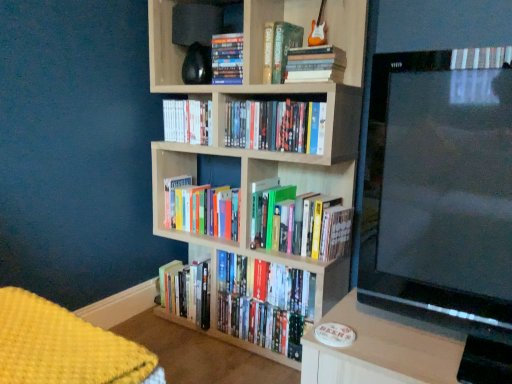
Question: Does yellow knitted blanket at lower left have a lesser height compared to black glossy tv at right?

Choices:
 (A) no
 (B) yes

Answer: (B)

Question: From a real-world perspective, is yellow knitted blanket at lower left positioned under black glossy tv at right based on gravity?

Choices:
 (A) no
 (B) yes

Answer: (B)

Question: Does yellow knitted blanket at lower left have a greater height compared to black glossy tv at right?

Choices:
 (A) no
 (B) yes

Answer: (A)

Question: Would you say yellow knitted blanket at lower left contains black glossy tv at right?

Choices:
 (A) no
 (B) yes

Answer: (A)

Question: Can we say yellow knitted blanket at lower left lies outside black glossy tv at right?

Choices:
 (A) no
 (B) yes

Answer: (B)

Question: Is hardcover book at center, which is counted as the 1th book, starting from the top, wider or thinner than matte black shelf at upper center?

Choices:
 (A) thin
 (B) wide

Answer: (A)

Question: In terms of height, does hardcover book at center, the 8th book positioned from the bottom, look taller or shorter compared to matte black shelf at upper center?

Choices:
 (A) tall
 (B) short

Answer: (B)

Question: Is point (282, 72) closer or farther from the camera than point (157, 89)?

Choices:
 (A) farther
 (B) closer

Answer: (B)

Question: Is hardcover book at center, which is counted as the 1th book, starting from the top, bigger or smaller than matte black shelf at upper center?

Choices:
 (A) small
 (B) big

Answer: (A)

Question: Relative to black glossy tv at right, is hardcover book at center, arranged as the fourth book when viewed from the top, in front or behind?

Choices:
 (A) behind
 (B) front

Answer: (A)

Question: Considering the positions of hardcover book at center, the 5th book when ordered from bottom to top, and black glossy tv at right in the image, is hardcover book at center, the 5th book when ordered from bottom to top, taller or shorter than black glossy tv at right?

Choices:
 (A) tall
 (B) short

Answer: (B)

Question: In terms of size, does hardcover book at center, the 5th book when ordered from bottom to top, appear bigger or smaller than black glossy tv at right?

Choices:
 (A) small
 (B) big

Answer: (A)

Question: In the image, is hardcover book at center, arranged as the fourth book when viewed from the top, on the left side or the right side of black glossy tv at right?

Choices:
 (A) right
 (B) left

Answer: (B)

Question: Is hardcover books at center, the sixth book from the top, bigger or smaller than hardcover books at center, arranged as the fifth book when viewed from the top?

Choices:
 (A) small
 (B) big

Answer: (B)

Question: In the image, is hardcover books at center, marked as the 3th book in a bottom-to-top arrangement, positioned in front of or behind hardcover books at center, which is the fourth book in bottom-to-top order?

Choices:
 (A) front
 (B) behind

Answer: (B)